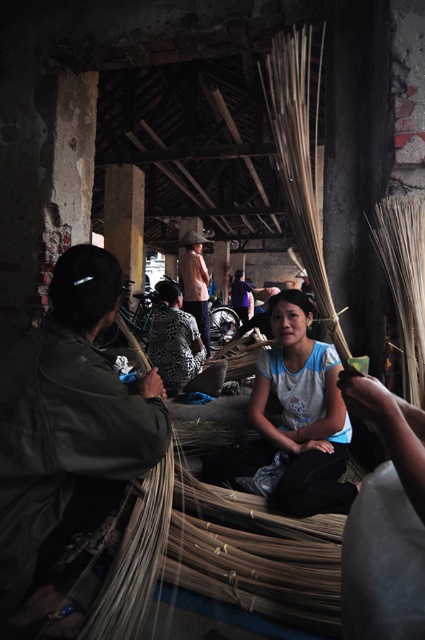
This screenshot has width=425, height=640. What do you see at coordinates (175, 339) in the screenshot?
I see `printed fabric shirt at center` at bounding box center [175, 339].

Can you confirm if printed fabric shirt at center is taller than light brown woven hat at upper center?

No.

Is point (153, 348) closer to camera compared to point (180, 260)?

Yes, it is in front of point (180, 260).

This screenshot has width=425, height=640. Find the location of `printed fabric shirt at center`. printed fabric shirt at center is located at coordinates (175, 339).

Does blue cotton shirt at center have a smaller size compared to printed fabric shirt at center?

Yes.

Can you confirm if blue cotton shirt at center is taller than printed fabric shirt at center?

Incorrect, blue cotton shirt at center's height is not larger of printed fabric shirt at center's.

Locate an element on the screen. The width and height of the screenshot is (425, 640). blue cotton shirt at center is located at coordinates (300, 413).

Can you confirm if dark green leather jacket at left is positioned to the left of light brown woven hat at upper center?

No, dark green leather jacket at left is not to the left of light brown woven hat at upper center.

Between dark green leather jacket at left and light brown woven hat at upper center, which one is positioned higher?

Positioned higher is light brown woven hat at upper center.

Does point (17, 429) come behind point (184, 288)?

No, (17, 429) is in front of (184, 288).

What are the coordinates of `dark green leather jacket at left` in the screenshot? It's located at (68, 428).